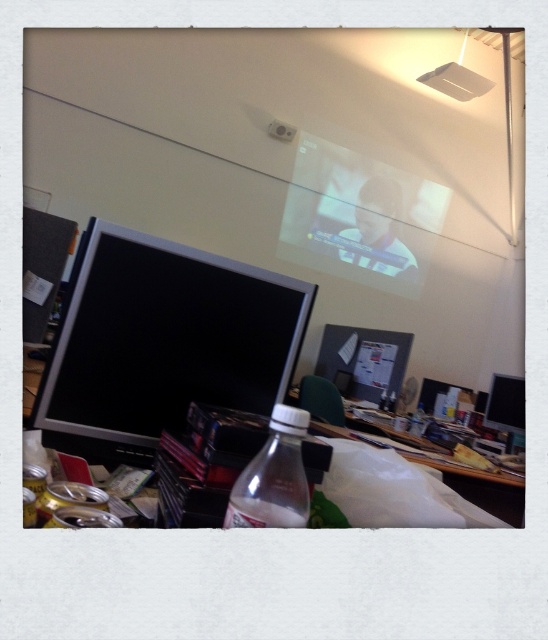
You are organizing a small meeting in this workspace and need to place a laptop on the translucent plastic table at center and the black glossy monitor at right. Which surface can accommodate a wider laptop?

The translucent plastic table at center has a larger width than the black glossy monitor at right, so it can accommodate a wider laptop.

You are an office worker who needs to place a new keyboard between the satin black monitor at center and the black glossy monitor at right. Can you fit the keyboard in the space between them?

The satin black monitor at center might be wider than black glossy monitor at right, so there might not be enough space to fit the keyboard between them.